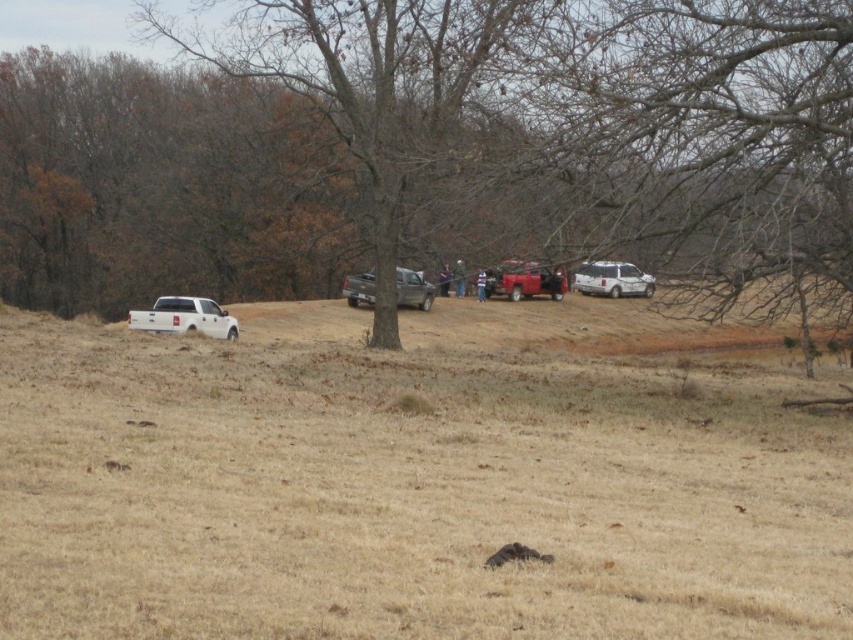
You are standing at point A, which is located at the coordinates of point (212,492). You want to walk to point B at coordinates point (445,289). Which direction should you move relative to the scene?

You should move towards the direction away from the viewer since point (212,492) is in front of point (445,289). This means point (445,289) is behind point (212,492), so moving away from the viewer would take you towards point B.

You are standing at the edge of the brown grassy field at lower center. Looking towards the midground, you see a dirt clearing with parked vehicles. Can you determine the direction of the white pickup truck relative to the gray pickup truck based on their positions?

The white pickup truck is to the left of the gray pickup truck in the dirt clearing.